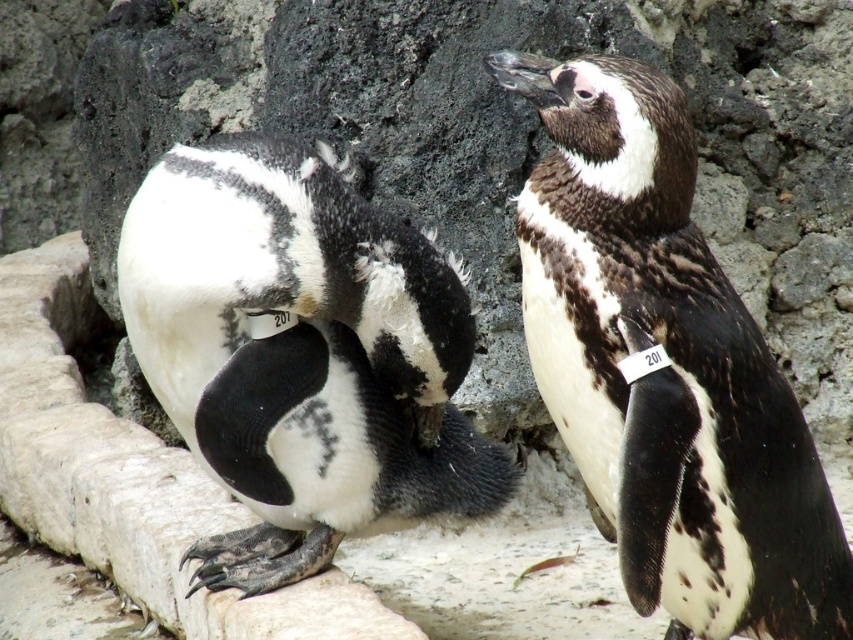
You are a zookeeper observing two penguins in their enclosure. You notice a black and white feathers at center and a white matte penguin at center. Which of these two is positioned to the right side of the other?

The black and white feathers at center is to the right of the white matte penguin at center.

You are a zookeeper observing two penguins in their enclosure. You notice a specific point marked at coordinates point [665,368]. Which object from the scene is located exactly at this point?

The black and white feathers at center are located exactly at point [665,368].

You are observing two penguins in a zoo. You notice the black and white feathers at center. Based on their positions, which penguin do you think the feathers belong to?

The black and white feathers at center belong to the penguin on the right because the coordinates provided indicate it is positioned at the center of the image.